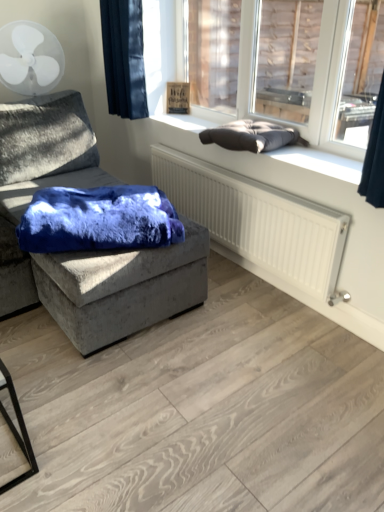
Question: Is dark blue fabric at upper left wider than white plastic mechanical fan at upper left?

Choices:
 (A) yes
 (B) no

Answer: (B)

Question: Is dark blue fabric at upper left facing away from white plastic mechanical fan at upper left?

Choices:
 (A) no
 (B) yes

Answer: (A)

Question: Can you confirm if dark blue fabric at upper left is thinner than white plastic mechanical fan at upper left?

Choices:
 (A) no
 (B) yes

Answer: (B)

Question: Is dark blue fabric at upper left in contact with white plastic mechanical fan at upper left?

Choices:
 (A) no
 (B) yes

Answer: (A)

Question: From a real-world perspective, is dark blue fabric at upper left located beneath white plastic mechanical fan at upper left?

Choices:
 (A) no
 (B) yes

Answer: (A)

Question: Based on their sizes in the image, would you say white plastic mechanical fan at upper left is bigger or smaller than dark gray cushion at upper right?

Choices:
 (A) small
 (B) big

Answer: (B)

Question: In terms of height, does white plastic mechanical fan at upper left look taller or shorter compared to dark gray cushion at upper right?

Choices:
 (A) short
 (B) tall

Answer: (B)

Question: From a real-world perspective, relative to dark gray cushion at upper right, is white plastic mechanical fan at upper left vertically above or below?

Choices:
 (A) below
 (B) above

Answer: (B)

Question: Considering their positions, is white plastic mechanical fan at upper left located in front of or behind dark gray cushion at upper right?

Choices:
 (A) behind
 (B) front

Answer: (A)

Question: Which is correct: dark gray cushion at upper right is inside dark blue fabric at upper left, or outside of it?

Choices:
 (A) inside
 (B) outside

Answer: (B)

Question: Is dark gray cushion at upper right taller or shorter than dark blue fabric at upper left?

Choices:
 (A) short
 (B) tall

Answer: (A)

Question: Considering the positions of dark gray cushion at upper right and dark blue fabric at upper left in the image, is dark gray cushion at upper right wider or thinner than dark blue fabric at upper left?

Choices:
 (A) wide
 (B) thin

Answer: (A)

Question: From the image's perspective, is dark gray cushion at upper right positioned above or below dark blue fabric at upper left?

Choices:
 (A) below
 (B) above

Answer: (A)

Question: Based on their sizes in the image, would you say dark gray cushion at upper right is bigger or smaller than dark blue fabric at upper left?

Choices:
 (A) small
 (B) big

Answer: (B)

Question: In the image, is dark gray cushion at upper right on the left side or the right side of dark blue fabric at upper left?

Choices:
 (A) right
 (B) left

Answer: (A)